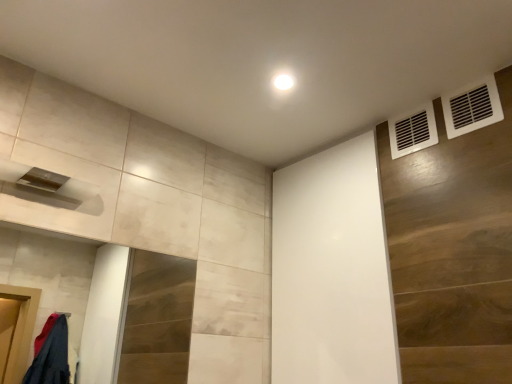
This screenshot has height=384, width=512. Describe the element at coordinates (332, 271) in the screenshot. I see `white matte screen door at upper center` at that location.

The width and height of the screenshot is (512, 384). I want to click on white matte screen door at upper center, so click(x=332, y=271).

Is white plastic vent at upper right, acting as the second air conditioning starting from the back, directly adjacent to white matte screen door at upper center?

No, white plastic vent at upper right, acting as the second air conditioning starting from the back, is not in contact with white matte screen door at upper center.

Is white plastic vent at upper right, the first air conditioning when ordered from right to left, in front of or behind white matte screen door at upper center in the image?

Clearly, white plastic vent at upper right, the first air conditioning when ordered from right to left, is in front of white matte screen door at upper center.

Does white plastic vent at upper right, the first air conditioning when ordered from front to back, turn towards white matte screen door at upper center?

No, white plastic vent at upper right, the first air conditioning when ordered from front to back, is not turned towards white matte screen door at upper center.

Considering the sizes of white plastic vent at upper right, acting as the second air conditioning starting from the back, and white matte screen door at upper center in the image, is white plastic vent at upper right, acting as the second air conditioning starting from the back, wider or thinner than white matte screen door at upper center?

In the image, white plastic vent at upper right, acting as the second air conditioning starting from the back, appears to be more narrow than white matte screen door at upper center.

How many degrees apart are the facing directions of white matte screen door at upper center and white plastic vent at upper right, the first air conditioning when ordered from front to back?

There is a 1.95-degree angle between the facing directions of white matte screen door at upper center and white plastic vent at upper right, the first air conditioning when ordered from front to back.

Which object is positioned more to the left, white matte screen door at upper center or white plastic vent at upper right, the first air conditioning when ordered from front to back?

From the viewer's perspective, white matte screen door at upper center appears more on the left side.

Does white matte screen door at upper center have a smaller size compared to white plastic vent at upper right, which is the second air conditioning in left-to-right order?

No.

Is white matte screen door at upper center situated inside white plastic vent at upper right, the first air conditioning when ordered from right to left, or outside?

white matte screen door at upper center lies outside white plastic vent at upper right, the first air conditioning when ordered from right to left.

Is white plastic vent at upper right, the second air conditioning in the front-to-back sequence, taller or shorter than white matte screen door at upper center?

In the image, white plastic vent at upper right, the second air conditioning in the front-to-back sequence, appears to be shorter than white matte screen door at upper center.

From a real-world perspective, who is located higher, white plastic vent at upper right, positioned as the first air conditioning in left-to-right order, or white matte screen door at upper center?

From a 3D spatial view, white plastic vent at upper right, positioned as the first air conditioning in left-to-right order, is above.

Which is in front, point (416, 131) or point (361, 336)?

The point (361, 336) is more forward.

Between white plastic vent at upper right, positioned as the first air conditioning in left-to-right order, and white matte screen door at upper center, which one has larger size?

Bigger between the two is white matte screen door at upper center.

What's the angular difference between white matte screen door at upper center and white plastic vent at upper right, the second air conditioning in the front-to-back sequence,'s facing directions?

They differ by 1.95 degrees in their facing directions.

Is white matte screen door at upper center in front of or behind white plastic vent at upper right, the 1th air conditioning from the back, in the image?

white matte screen door at upper center is in front of white plastic vent at upper right, the 1th air conditioning from the back.

Is there a large distance between white matte screen door at upper center and white plastic vent at upper right, positioned as the first air conditioning in left-to-right order?

No.

The width and height of the screenshot is (512, 384). What are the coordinates of `screen door that is on the left side of white plastic vent at upper right, the second air conditioning from the right` in the screenshot? It's located at (332, 271).

Locate an element on the screen. This screenshot has height=384, width=512. air conditioning located above the white plastic vent at upper right, the second air conditioning in the front-to-back sequence (from the image's perspective) is located at coordinates (472, 107).

Who is more distant, white plastic vent at upper right, the 1th air conditioning from the back, or white plastic vent at upper right, acting as the second air conditioning starting from the back?

white plastic vent at upper right, the 1th air conditioning from the back, is further from the camera.

Is white plastic vent at upper right, the second air conditioning from the right, with white plastic vent at upper right, which is the second air conditioning in left-to-right order?

They are not placed beside each other.

Is white plastic vent at upper right, the first air conditioning when ordered from front to back, surrounded by white plastic vent at upper right, positioned as the first air conditioning in left-to-right order?

Definitely not — white plastic vent at upper right, the first air conditioning when ordered from front to back, is not inside white plastic vent at upper right, positioned as the first air conditioning in left-to-right order.

Is white plastic vent at upper right, the first air conditioning when ordered from front to back, far from white plastic vent at upper right, the second air conditioning from the right?

Actually, white plastic vent at upper right, the first air conditioning when ordered from front to back, and white plastic vent at upper right, the second air conditioning from the right, are a little close together.

Consider the image. Considering the sizes of objects white plastic vent at upper right, which is the second air conditioning in left-to-right order, and white plastic vent at upper right, the second air conditioning from the right, in the image provided, who is thinner, white plastic vent at upper right, which is the second air conditioning in left-to-right order, or white plastic vent at upper right, the second air conditioning from the right,?

white plastic vent at upper right, the second air conditioning from the right, is thinner.

Considering the sizes of objects white plastic vent at upper right, which is the second air conditioning in left-to-right order, and white plastic vent at upper right, positioned as the first air conditioning in left-to-right order, in the image provided, who is bigger, white plastic vent at upper right, which is the second air conditioning in left-to-right order, or white plastic vent at upper right, positioned as the first air conditioning in left-to-right order,?

Bigger between the two is white plastic vent at upper right, positioned as the first air conditioning in left-to-right order.

Can you tell me how much white plastic vent at upper right, which is the second air conditioning in left-to-right order, and white plastic vent at upper right, positioned as the first air conditioning in left-to-right order, differ in facing direction?

There is a 7.4e-05-degree angle between the facing directions of white plastic vent at upper right, which is the second air conditioning in left-to-right order, and white plastic vent at upper right, positioned as the first air conditioning in left-to-right order.

Where is `screen door below the white plastic vent at upper right, the first air conditioning when ordered from front to back (from the image's perspective)`? screen door below the white plastic vent at upper right, the first air conditioning when ordered from front to back (from the image's perspective) is located at coordinates (332, 271).

At what (x,y) coordinates should I click in order to perform the action: click on screen door that appears below the white plastic vent at upper right, acting as the second air conditioning starting from the back (from a real-world perspective). Please return your answer as a coordinate pair (x, y). This screenshot has width=512, height=384. Looking at the image, I should click on (332, 271).

Looking at the image, which one is located further to white plastic vent at upper right, the first air conditioning when ordered from right to left, white plastic vent at upper right, the second air conditioning from the right, or white matte screen door at upper center?

white matte screen door at upper center is further to white plastic vent at upper right, the first air conditioning when ordered from right to left.

Estimate the real-world distances between objects in this image. Which object is closer to white matte screen door at upper center, white plastic vent at upper right, the first air conditioning when ordered from front to back, or white plastic vent at upper right, the second air conditioning from the right?

white plastic vent at upper right, the second air conditioning from the right, is closer to white matte screen door at upper center.

Based on the photo, estimate the real-world distances between objects in this image. Which object is further from white plastic vent at upper right, the first air conditioning when ordered from right to left, white matte screen door at upper center or white plastic vent at upper right, the second air conditioning in the front-to-back sequence?

white matte screen door at upper center lies further to white plastic vent at upper right, the first air conditioning when ordered from right to left, than the other object.

Based on their spatial positions, is white plastic vent at upper right, the first air conditioning when ordered from front to back, or white matte screen door at upper center closer to white plastic vent at upper right, the 1th air conditioning from the back?

white plastic vent at upper right, the first air conditioning when ordered from front to back, is closer to white plastic vent at upper right, the 1th air conditioning from the back.

In the scene shown: When comparing their distances from white plastic vent at upper right, the 1th air conditioning from the back, does white matte screen door at upper center or white plastic vent at upper right, the first air conditioning when ordered from right to left, seem further?

white matte screen door at upper center is further to white plastic vent at upper right, the 1th air conditioning from the back.

Considering their positions, is white plastic vent at upper right, the second air conditioning from the right, positioned closer to white matte screen door at upper center than white plastic vent at upper right, the first air conditioning when ordered from right to left?

white plastic vent at upper right, the second air conditioning from the right, lies closer to white matte screen door at upper center than the other object.

Identify the location of air conditioning between white plastic vent at upper right, the first air conditioning when ordered from right to left, and white matte screen door at upper center vertically. The image size is (512, 384). (413, 130).